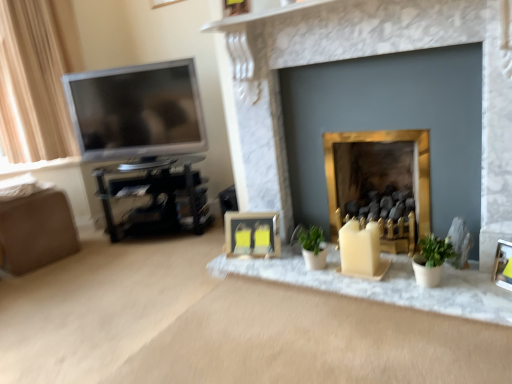
Question: From a real-world perspective, is metallic gold picture frame at lower right, placed as the first picture frame when sorted from front to back, under marble fireplace at center, which is counted as the second fireplace, starting from the right?

Choices:
 (A) yes
 (B) no

Answer: (A)

Question: Does metallic gold picture frame at lower right, arranged as the 2th picture frame when viewed from the back, appear on the left side of marble fireplace at center, which is counted as the second fireplace, starting from the right?

Choices:
 (A) yes
 (B) no

Answer: (B)

Question: Is marble fireplace at center, the first fireplace from the left, surrounded by metallic gold picture frame at lower right, placed as the first picture frame when sorted from front to back?

Choices:
 (A) no
 (B) yes

Answer: (A)

Question: Is metallic gold picture frame at lower right, which ranks as the 1th picture frame in right-to-left order, completely or partially outside of marble fireplace at center, the first fireplace from the left?

Choices:
 (A) yes
 (B) no

Answer: (A)

Question: From a real-world perspective, is metallic gold picture frame at lower right, which ranks as the 1th picture frame in right-to-left order, physically above marble fireplace at center, which is counted as the second fireplace, starting from the right?

Choices:
 (A) yes
 (B) no

Answer: (B)

Question: From a real-world perspective, is black plastic entertainment center at left positioned above or below gold metallic fireplace at center, arranged as the 1th fireplace when viewed from the right?

Choices:
 (A) above
 (B) below

Answer: (B)

Question: From the image's perspective, is black plastic entertainment center at left positioned above or below gold metallic fireplace at center, arranged as the 1th fireplace when viewed from the right?

Choices:
 (A) above
 (B) below

Answer: (B)

Question: From their relative heights in the image, would you say black plastic entertainment center at left is taller or shorter than gold metallic fireplace at center, the 2th fireplace positioned from the left?

Choices:
 (A) short
 (B) tall

Answer: (A)

Question: In terms of size, does black plastic entertainment center at left appear bigger or smaller than gold metallic fireplace at center, arranged as the 1th fireplace when viewed from the right?

Choices:
 (A) small
 (B) big

Answer: (B)

Question: From the image's perspective, relative to marble fireplace at center, the first fireplace from the left, is black plastic entertainment center at left above or below?

Choices:
 (A) above
 (B) below

Answer: (B)

Question: In terms of size, does black plastic entertainment center at left appear bigger or smaller than marble fireplace at center, which is counted as the second fireplace, starting from the right?

Choices:
 (A) small
 (B) big

Answer: (A)

Question: From a real-world perspective, is black plastic entertainment center at left above or below marble fireplace at center, the first fireplace from the left?

Choices:
 (A) above
 (B) below

Answer: (B)

Question: Considering the relative positions of black plastic entertainment center at left and marble fireplace at center, which is counted as the second fireplace, starting from the right, in the image provided, is black plastic entertainment center at left to the left or to the right of marble fireplace at center, which is counted as the second fireplace, starting from the right,?

Choices:
 (A) left
 (B) right

Answer: (A)

Question: Is satin silver television at left spatially inside black plastic entertainment center at left, or outside of it?

Choices:
 (A) inside
 (B) outside

Answer: (B)

Question: Is satin silver television at left in front of or behind black plastic entertainment center at left in the image?

Choices:
 (A) front
 (B) behind

Answer: (A)